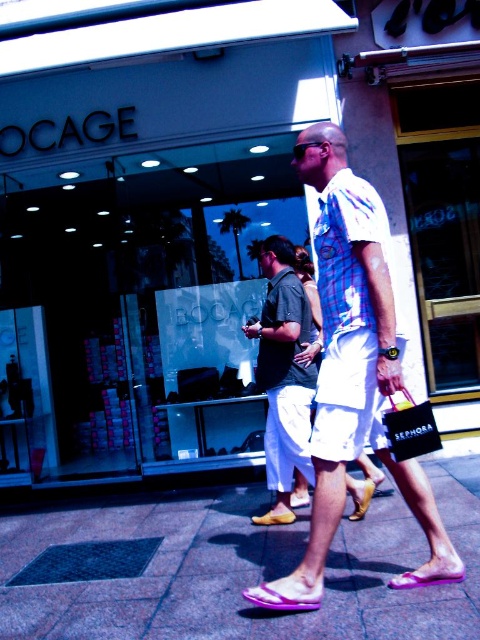
Question: Estimate the real-world distances between objects in this image. Which object is farther from the matte glass storefront at center?

Choices:
 (A) purple fabric sandal at lower center
 (B) purple rubber sandals at center
 (C) dark gray cotton shirt at center
 (D) leather tan sandal at lower center

Answer: (A)

Question: Can you confirm if plaid cotton shirt at center is wider than dark gray cotton shirt at center?

Choices:
 (A) yes
 (B) no

Answer: (A)

Question: Is matte glass storefront at center above purple rubber sandal at lower center?

Choices:
 (A) no
 (B) yes

Answer: (B)

Question: Which object appears closest to the camera in this image?

Choices:
 (A) purple rubber sandals at center
 (B) purple fabric sandal at lower center
 (C) purple rubber sandal at lower center

Answer: (A)

Question: Is matte glass storefront at center further to camera compared to leather tan sandal at lower center?

Choices:
 (A) no
 (B) yes

Answer: (B)

Question: Which point appears closest to the camera in this image?

Choices:
 (A) (244, 604)
 (B) (274, 477)
 (C) (264, 582)

Answer: (A)